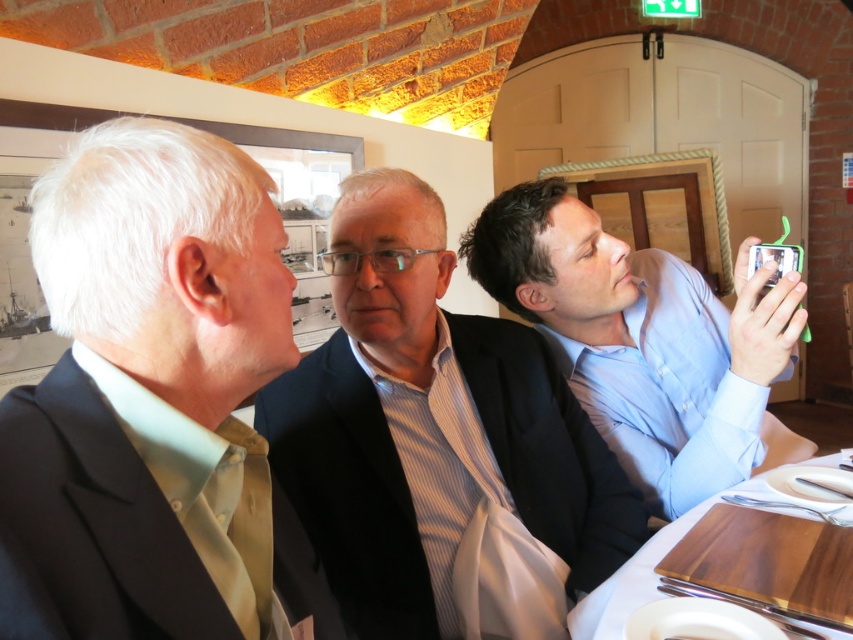
You are a tailor observing two suits displayed in a store window. The light beige suit at center and the dark blue suit at center are both on mannequins. Which suit is shorter in height?

The light beige suit at center is shorter in height compared to the dark blue suit at center.